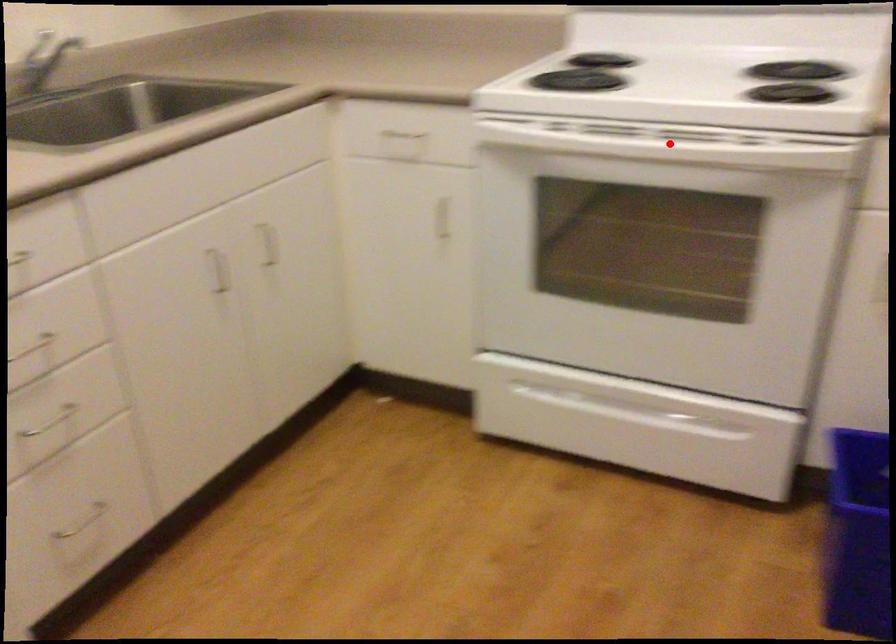
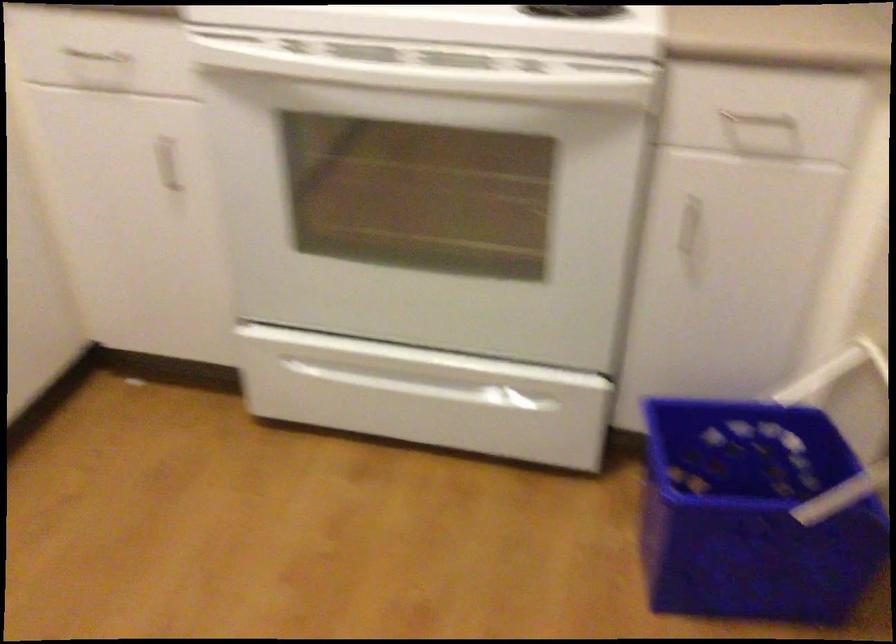
The point at the highlighted location is marked in the first image. Where is the corresponding point in the second image?

(437, 77)